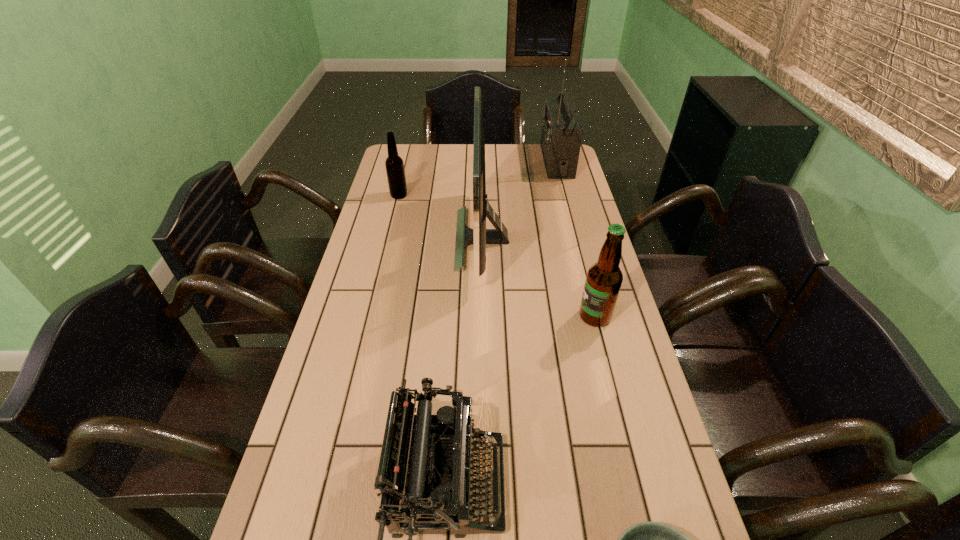
Locate an element on the screen. This screenshot has width=960, height=540. object that is at the far right corner is located at coordinates (561, 136).

At what (x,y) coordinates should I click in order to perform the action: click on vacant area at the far edge. Please return your answer as a coordinate pair (x, y). The height and width of the screenshot is (540, 960). Looking at the image, I should click on tap(521, 161).

In the image, there is a desktop. At what (x,y) coordinates should I click in order to perform the action: click on vacant space at the left edge. Please return your answer as a coordinate pair (x, y). Image resolution: width=960 pixels, height=540 pixels. Looking at the image, I should click on (395, 228).

The width and height of the screenshot is (960, 540). In the image, there is a desktop. Identify the location of free region at the right edge. (587, 361).

Image resolution: width=960 pixels, height=540 pixels. Identify the location of vacant region at the far left corner of the desktop. (425, 173).

Identify the location of vacant position at the far right corner of the desktop. (531, 150).

Find the location of a particular element. free space between the left beer bottle and the nearer beer bottle is located at coordinates (497, 256).

Locate an element on the screen. empty space that is in between the radio receiver and the monitor is located at coordinates (519, 200).

This screenshot has width=960, height=540. I want to click on free spot between the monitor and the shorter beer bottle, so click(x=441, y=217).

Find the location of a particular element. free space between the monitor and the fourth shortest object is located at coordinates (539, 278).